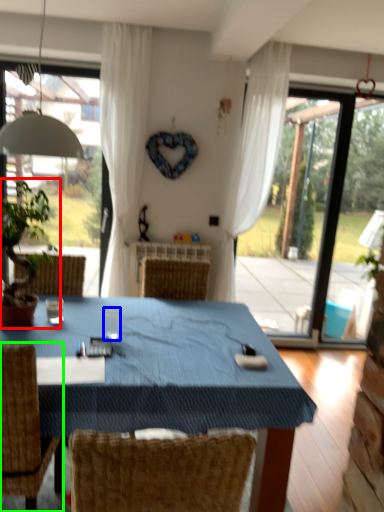
Question: Considering the real-world distances, which object is closest to houseplant (highlighted by a red box)? coffee cup (highlighted by a blue box) or chair (highlighted by a green box).

Choices:
 (A) coffee cup
 (B) chair

Answer: (A)